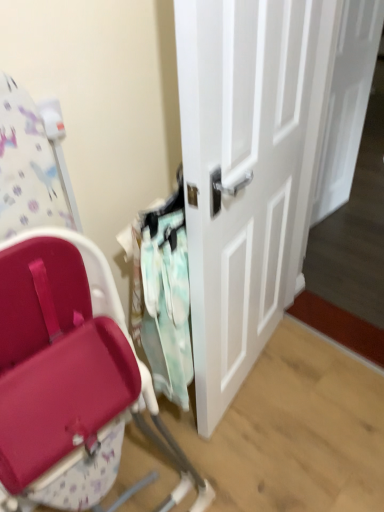
Image resolution: width=384 pixels, height=512 pixels. I want to click on vacant space underneath white glossy door at center, the second door positioned from the back (from a real-world perspective), so [261, 366].